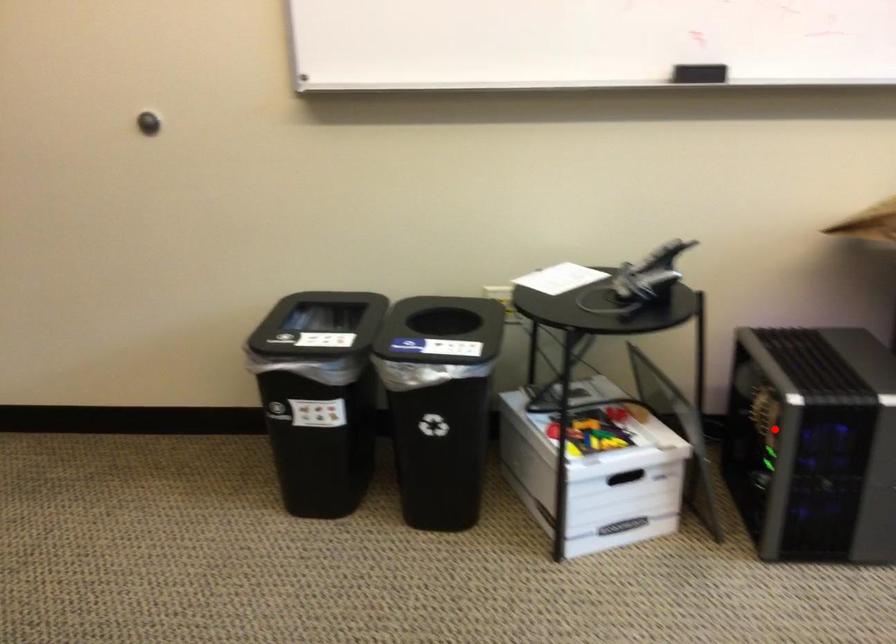
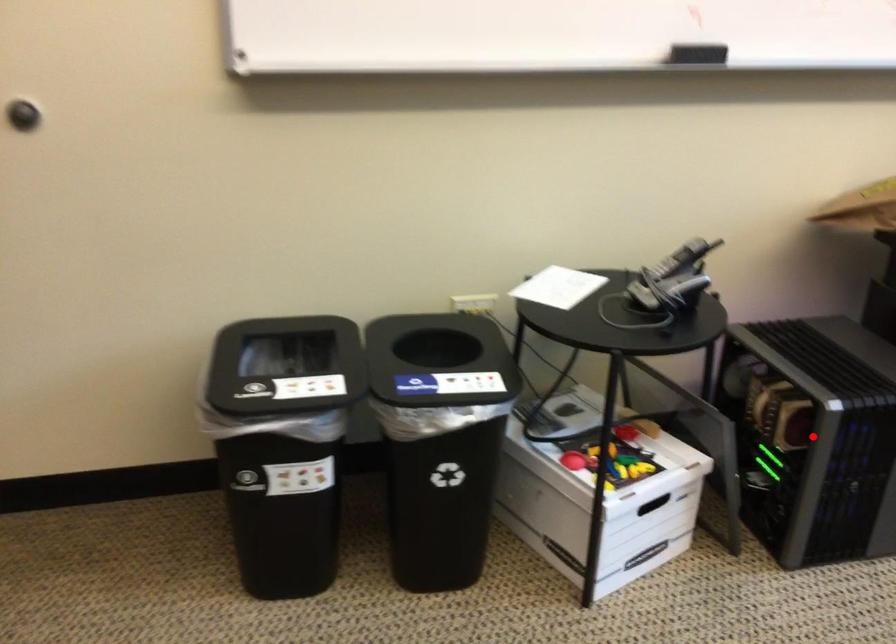
I am providing you with two images of the same scene from different viewpoints. A red point is marked on the first image and another point is marked on the second image. Are the points marked in image1 and image2 representing the same 3D position?

Yes